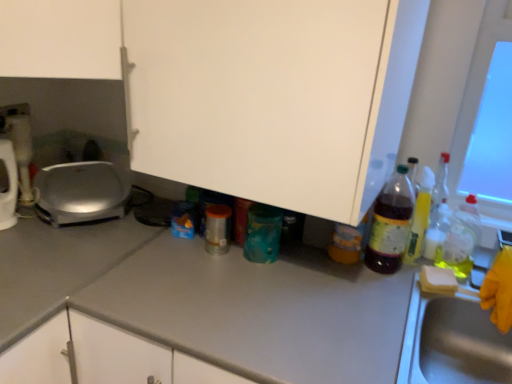
In order to click on vacant area that is in front of metallic silver can at center, which appears as the 1th bottle when viewed from the left in this screenshot , I will do `click(205, 276)`.